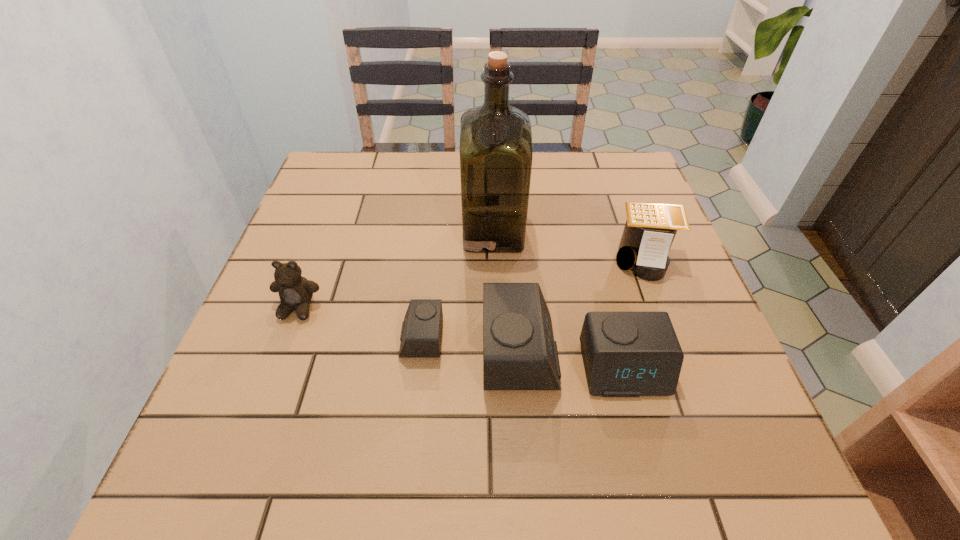
The height and width of the screenshot is (540, 960). I want to click on vacant point located between the teddy bear and the second shortest alarm clock, so click(461, 339).

The height and width of the screenshot is (540, 960). I want to click on blank region between the rightmost alarm clock and the leftmost object, so click(x=461, y=339).

In order to click on vacant area that lies between the rightmost alarm clock and the second alarm clock from left to right in this screenshot , I will do `click(572, 361)`.

Point out which object is positioned as the second nearest to the second tallest alarm clock. Please provide its 2D coordinates. Your answer should be formatted as a tuple, i.e. [(x, y)], where the tuple contains the x and y coordinates of a point satisfying the conditions above.

[(650, 228)]

Locate an element on the screen. object that stands as the third closest to the second alarm clock from left to right is located at coordinates (496, 153).

You are a GUI agent. You are given a task and a screenshot of the screen. Output one action in this format:
    pyautogui.click(x=<x>, y=<y>)
    Task: Click on the alarm clock that stands as the closest to the second shortest object
    This screenshot has width=960, height=540.
    Given the screenshot: What is the action you would take?
    pyautogui.click(x=519, y=352)

The image size is (960, 540). In order to click on alarm clock that is the second closest one to the fifth object from right to left in this screenshot , I will do `click(626, 354)`.

This screenshot has height=540, width=960. I want to click on free space that satisfies the following two spatial constraints: 1. on the label of the calculator; 2. on the left side of the tallest object, so click(493, 259).

Locate an element on the screen. free space that satisfies the following two spatial constraints: 1. on the front side of the calculator; 2. on the front-facing side of the fifth object from right to left is located at coordinates (674, 339).

The height and width of the screenshot is (540, 960). In order to click on free space that satisfies the following two spatial constraints: 1. on the label of the calculator; 2. on the left side of the liquor in this screenshot , I will do `click(493, 259)`.